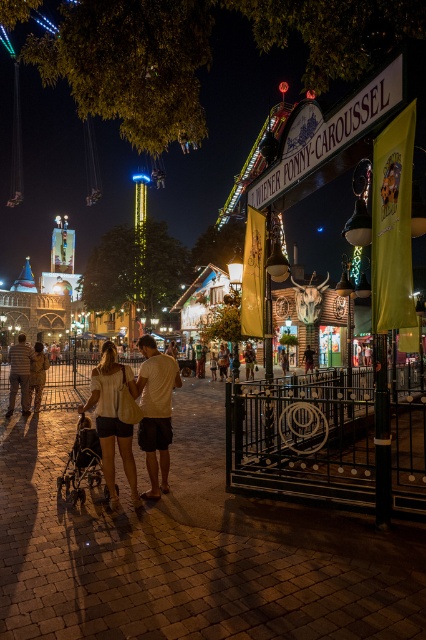
You are standing at the entrance of the Wiener Ponny Caroussel and see the point marked at coordinates (155, 410). What object is located at that point?

The point at coordinates (155, 410) indicates light beige shorts at center.

You are standing at the entrance of the amusement park and see the light beige shorts at center and the matte black stroller at lower left. Which object is wider?

The light beige shorts at center is wider than the matte black stroller at lower left.

You are standing at the cobblestone pathway in the amusement park and see the light beige cotton shirt at center and the light beige shorts at center. Which one of these items is wider from your perspective?

The light beige cotton shirt at center might be wider than light beige shorts at center.